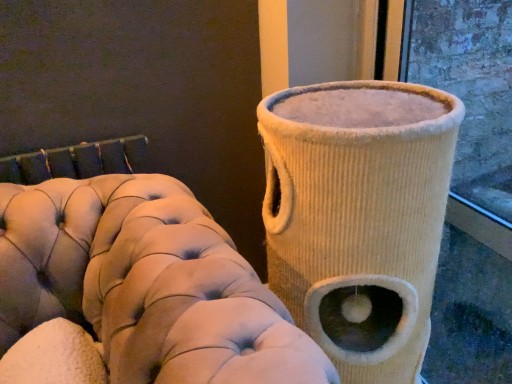
This screenshot has width=512, height=384. In order to click on beige corduroy cat tree at right in this screenshot , I will do `click(145, 284)`.

In order to face beige corduroy cat tree at right, should I rotate leftwards or rightwards?

Rotate your view left by about 13.398°.

What do you see at coordinates (145, 284) in the screenshot? I see `beige corduroy cat tree at right` at bounding box center [145, 284].

Locate an element on the screen. This screenshot has width=512, height=384. beige corduroy cat tree at right is located at coordinates (359, 217).

The width and height of the screenshot is (512, 384). What do you see at coordinates (359, 217) in the screenshot?
I see `beige corduroy cat tree at right` at bounding box center [359, 217].

Locate an element on the screen. The height and width of the screenshot is (384, 512). beige corduroy cat tree at right is located at coordinates (145, 284).

Which object is positioned more to the left, beige corduroy cat tree at right or beige corduroy cat tree at right?

beige corduroy cat tree at right is more to the left.

Which object is further away from the camera taking this photo, beige corduroy cat tree at right or beige corduroy cat tree at right?

beige corduroy cat tree at right is more distant.

Is point (404, 257) farther from viewer compared to point (118, 298)?

Yes, it is.

From the image's perspective, which is above, beige corduroy cat tree at right or beige corduroy cat tree at right?

beige corduroy cat tree at right appears higher in the image.

From a real-world perspective, is beige corduroy cat tree at right located beneath beige corduroy cat tree at right?

Yes.

Consider the image. Looking at their sizes, would you say beige corduroy cat tree at right is wider or thinner than beige corduroy cat tree at right?

beige corduroy cat tree at right is thinner than beige corduroy cat tree at right.

Considering the sizes of beige corduroy cat tree at right and beige corduroy cat tree at right in the image, is beige corduroy cat tree at right taller or shorter than beige corduroy cat tree at right?

Considering their sizes, beige corduroy cat tree at right has more height than beige corduroy cat tree at right.

Does beige corduroy cat tree at right have a smaller size compared to beige corduroy cat tree at right?

Correct, beige corduroy cat tree at right occupies less space than beige corduroy cat tree at right.

Is beige corduroy cat tree at right completely or partially outside of beige corduroy cat tree at right?

Yes.

Is beige corduroy cat tree at right beside beige corduroy cat tree at right?

No.

Could you tell me if beige corduroy cat tree at right is facing beige corduroy cat tree at right?

No, beige corduroy cat tree at right is not aimed at beige corduroy cat tree at right.

In the image, there is a beige corduroy cat tree at right. Identify the location of vase below it (from a real-world perspective). This screenshot has width=512, height=384. (359, 217).

Does beige corduroy cat tree at right appear on the right side of beige corduroy cat tree at right?

Incorrect, beige corduroy cat tree at right is not on the right side of beige corduroy cat tree at right.

Is beige corduroy cat tree at right in front of or behind beige corduroy cat tree at right in the image?

In the image, beige corduroy cat tree at right appears in front of beige corduroy cat tree at right.

Which point is more forward, (x=179, y=238) or (x=350, y=323)?

The point (x=179, y=238) is closer.

From the image's perspective, which is below, beige corduroy cat tree at right or beige corduroy cat tree at right?

beige corduroy cat tree at right, from the image's perspective.

From a real-world perspective, is beige corduroy cat tree at right physically located above or below beige corduroy cat tree at right?

In terms of real-world spatial position, beige corduroy cat tree at right is above beige corduroy cat tree at right.

Consider the image. Considering the sizes of objects beige corduroy cat tree at right and beige corduroy cat tree at right in the image provided, who is thinner, beige corduroy cat tree at right or beige corduroy cat tree at right?

beige corduroy cat tree at right.

From their relative heights in the image, would you say beige corduroy cat tree at right is taller or shorter than beige corduroy cat tree at right?

In the image, beige corduroy cat tree at right appears to be shorter than beige corduroy cat tree at right.

Who is bigger, beige corduroy cat tree at right or beige corduroy cat tree at right?

Bigger between the two is beige corduroy cat tree at right.

Would you say beige corduroy cat tree at right contains beige corduroy cat tree at right?

No, beige corduroy cat tree at right is not a part of beige corduroy cat tree at right.

Are beige corduroy cat tree at right and beige corduroy cat tree at right far apart?

They are positioned close to each other.

Could you tell me if beige corduroy cat tree at right is facing beige corduroy cat tree at right?

No, beige corduroy cat tree at right is not facing towards beige corduroy cat tree at right.

How many degrees apart are the facing directions of beige corduroy cat tree at right and beige corduroy cat tree at right?

The angular difference between beige corduroy cat tree at right and beige corduroy cat tree at right is 5.84 degrees.

The height and width of the screenshot is (384, 512). In order to click on furniture on the left of the beige corduroy cat tree at right in this screenshot , I will do `click(145, 284)`.

Image resolution: width=512 pixels, height=384 pixels. In order to click on vase below the beige corduroy cat tree at right (from a real-world perspective) in this screenshot , I will do `click(359, 217)`.

Identify the location of furniture located on the left of beige corduroy cat tree at right. Image resolution: width=512 pixels, height=384 pixels. (145, 284).